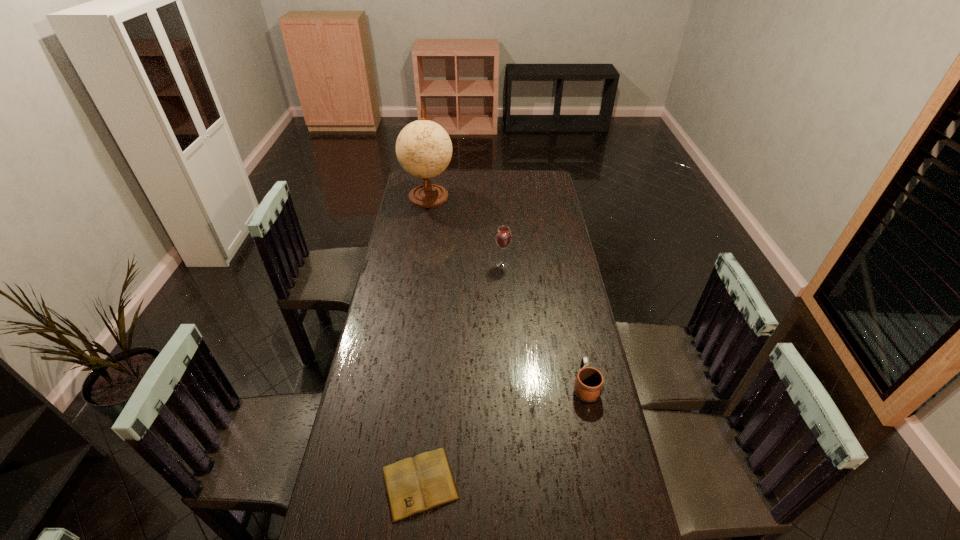
The width and height of the screenshot is (960, 540). I want to click on vacant area at the left edge, so click(381, 295).

In the image, there is a desktop. At what (x,y) coordinates should I click in order to perform the action: click on blank space at the right edge. Please return your answer as a coordinate pair (x, y). This screenshot has width=960, height=540. Looking at the image, I should click on (571, 288).

This screenshot has height=540, width=960. In the image, there is a desktop. In order to click on vacant space at the far left corner in this screenshot , I will do `click(406, 179)`.

Image resolution: width=960 pixels, height=540 pixels. Find the location of `free space between the second nearest object and the shortest object`. free space between the second nearest object and the shortest object is located at coordinates (502, 435).

Identify the location of vacant region between the second shortest object and the wineglass. This screenshot has height=540, width=960. (543, 325).

Locate an element on the screen. The height and width of the screenshot is (540, 960). free point between the third nearest object and the nearest object is located at coordinates (461, 374).

The image size is (960, 540). Identify the location of free spot between the second nearest object and the nearest object. (502, 435).

The image size is (960, 540). Find the location of `free spot between the second tallest object and the mug`. free spot between the second tallest object and the mug is located at coordinates pyautogui.click(x=543, y=325).

Find the location of a particular element. unoccupied area between the second object from right to left and the rightmost object is located at coordinates (543, 325).

Locate an element on the screen. Image resolution: width=960 pixels, height=540 pixels. vacant area that lies between the farthest object and the second object from right to left is located at coordinates (466, 230).